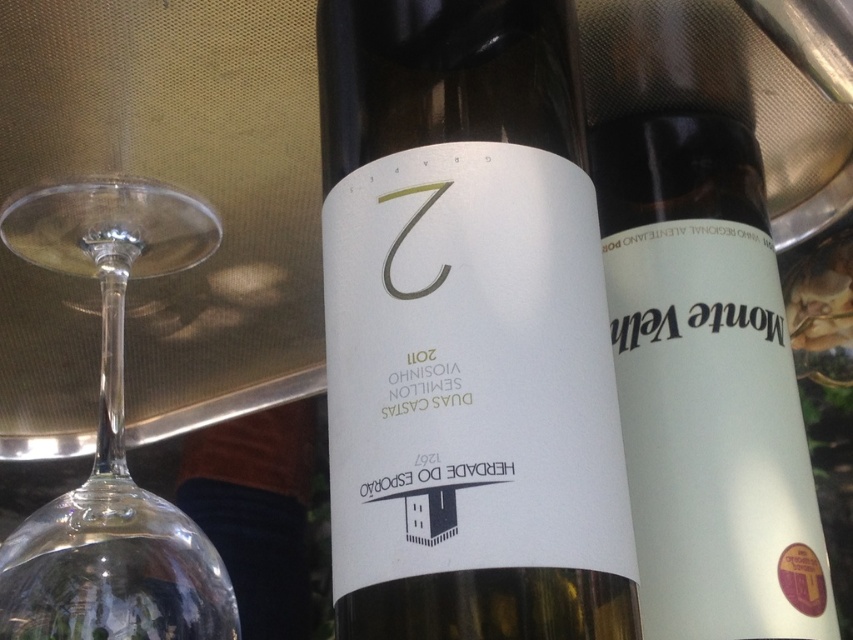
Does white glass bottle at center have a smaller size compared to transparent glass wine glass at left?

No, white glass bottle at center is not smaller than transparent glass wine glass at left.

Does white glass bottle at center appear over transparent glass wine glass at left?

Correct, white glass bottle at center is located above transparent glass wine glass at left.

Where is `white glass bottle at center`? white glass bottle at center is located at coordinates (466, 330).

This screenshot has height=640, width=853. Identify the location of white glass bottle at center. (466, 330).

Is white glass bottle at center to the right of white matte bottle at center from the viewer's perspective?

In fact, white glass bottle at center is to the left of white matte bottle at center.

Who is more distant from viewer, (x=404, y=422) or (x=672, y=161)?

The point (x=672, y=161) is more distant.

You are a GUI agent. You are given a task and a screenshot of the screen. Output one action in this format:
    pyautogui.click(x=<x>, y=<y>)
    Task: Click on the white glass bottle at center
    
    Given the screenshot: What is the action you would take?
    pyautogui.click(x=466, y=330)

Locate an element on the screen. Image resolution: width=853 pixels, height=640 pixels. white glass bottle at center is located at coordinates (466, 330).

Who is more forward, (785,352) or (114,625)?

Positioned in front is point (785,352).

Is white matte bottle at center wider than transparent glass wine glass at left?

Indeed, white matte bottle at center has a greater width compared to transparent glass wine glass at left.

Locate an element on the screen. The image size is (853, 640). white matte bottle at center is located at coordinates (711, 307).